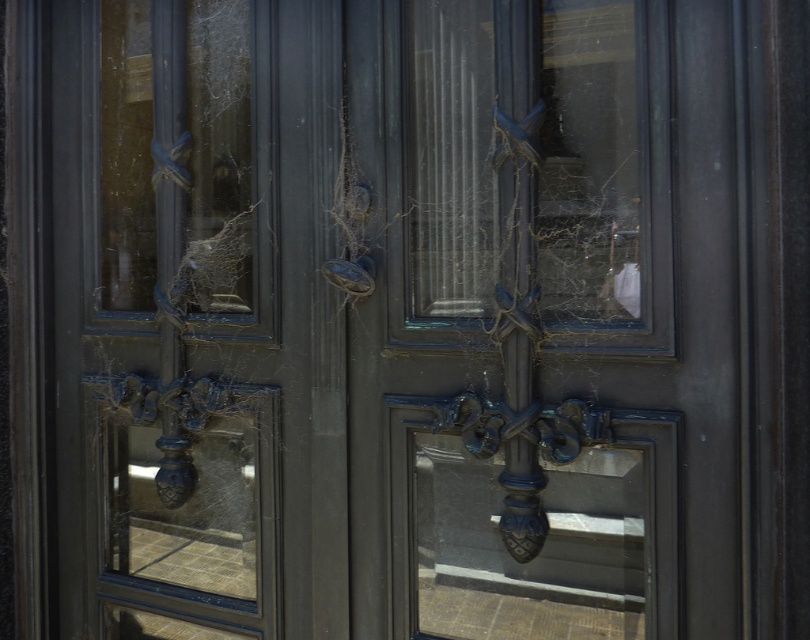
Question: Is matte dark blue screen door at center wider than matte dark blue door at center?

Choices:
 (A) yes
 (B) no

Answer: (B)

Question: Observing the image, what is the correct spatial positioning of matte dark blue screen door at center in reference to matte dark blue door at center?

Choices:
 (A) right
 (B) left

Answer: (A)

Question: Can you confirm if matte dark blue screen door at center is bigger than matte dark blue door at center?

Choices:
 (A) yes
 (B) no

Answer: (B)

Question: Which of the following is the closest to the observer?

Choices:
 (A) matte dark blue door at center
 (B) matte dark blue screen door at center

Answer: (B)